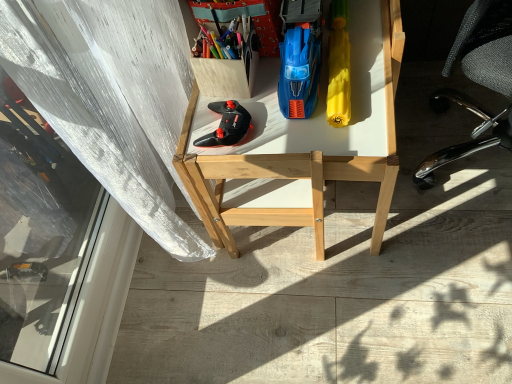
Locate an element on the screen. The height and width of the screenshot is (384, 512). free spot to the right of yellow matte umbrella at right, the fourth stationery from the left is located at coordinates (373, 39).